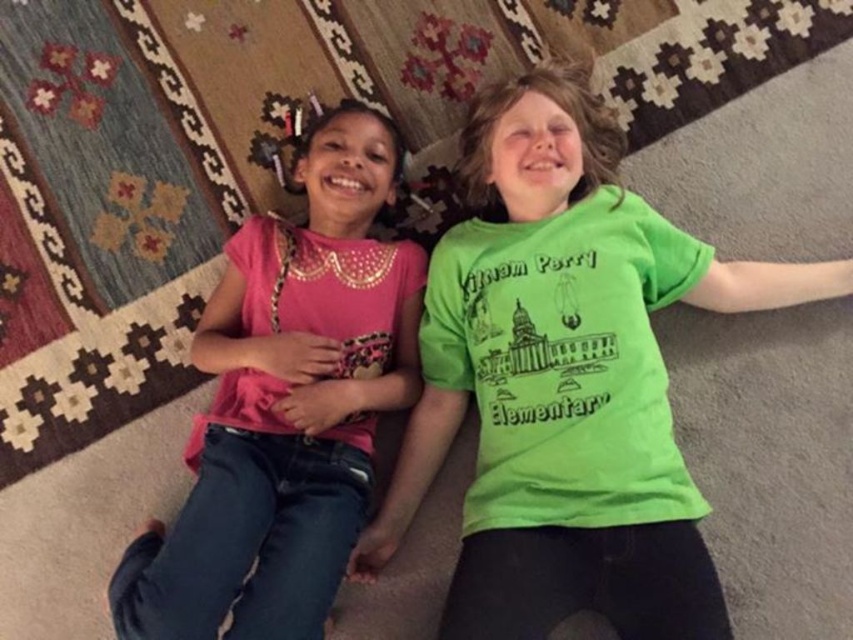
You are a photographer setting up a photo shoot with two children lying on a patterned carpet. You have a green matte shirt at center and a pink satin shirt at left. Which shirt should you choose to ensure it covers the child better due to its size?

The green matte shirt at center is larger in size than the pink satin shirt at left, so the green matte shirt at center would cover the child better due to its larger size.

You are a photographer standing at a certain distance from the green matte shirt at center. You want to take a photo of the shirt so that it fills the frame. Based on the description, what is the minimum distance you should be from the shirt to achieve this?

The green matte shirt at center is 3.69 feet away from the camera. To ensure the shirt fills the frame, you should position yourself at least 3.69 feet away from it.